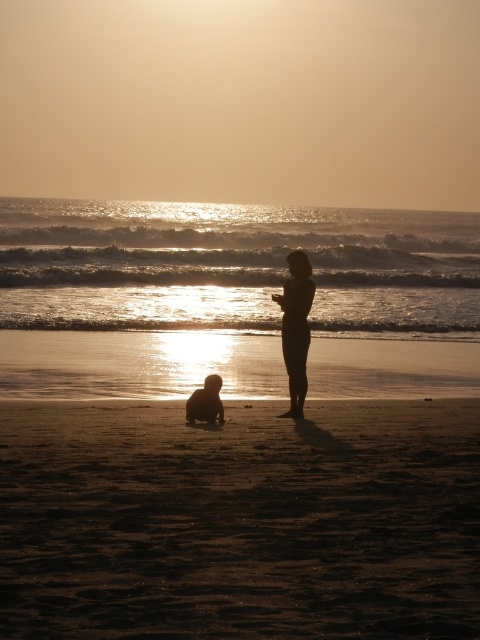
Does dark sand at center have a greater width compared to silhouette sand at lower center?

In fact, dark sand at center might be narrower than silhouette sand at lower center.

Is point (369, 440) in front of point (216, 394)?

Yes.

The width and height of the screenshot is (480, 640). I want to click on dark sand at center, so click(240, 520).

Where is `dark sand at center`? dark sand at center is located at coordinates (240, 520).

Is silhouette skin at center below silhouette sand at lower center?

No, silhouette skin at center is not below silhouette sand at lower center.

Who is taller, silhouette skin at center or silhouette sand at lower center?

With more height is silhouette skin at center.

You are a GUI agent. You are given a task and a screenshot of the screen. Output one action in this format:
    pyautogui.click(x=<x>, y=<y>)
    Task: Click on the silhouette skin at center
    This screenshot has height=640, width=480.
    Given the screenshot: What is the action you would take?
    pyautogui.click(x=296, y=326)

Can you confirm if dark sand at center is bigger than silhouette skin at center?

No, dark sand at center is not bigger than silhouette skin at center.

Between dark sand at center and silhouette skin at center, which one has more height?

Standing taller between the two is silhouette skin at center.

This screenshot has height=640, width=480. In order to click on dark sand at center in this screenshot , I will do `click(240, 520)`.